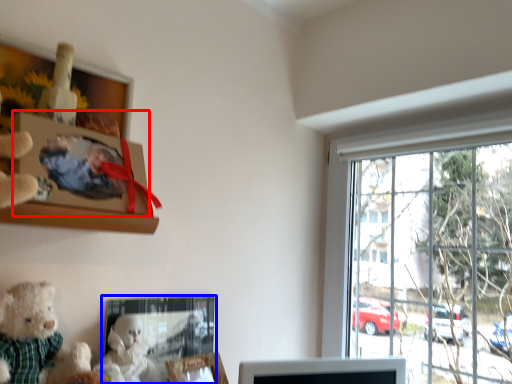
Question: Which of the following is the farthest to the observer, picture frame (highlighted by a red box) or picture frame (highlighted by a blue box)?

Choices:
 (A) picture frame
 (B) picture frame

Answer: (B)